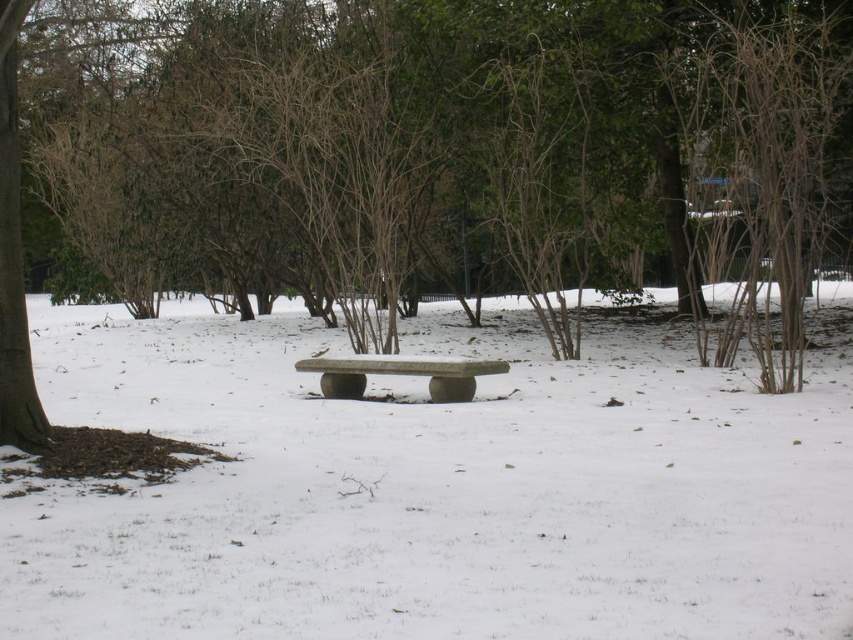
Is white matte bench at center closer to camera compared to green leafy tree at center?

Yes, white matte bench at center is closer to the viewer.

Locate an element on the screen. The height and width of the screenshot is (640, 853). white matte bench at center is located at coordinates (434, 490).

Is green leafy tree at center to the left of gray stone bench at center from the viewer's perspective?

No, green leafy tree at center is not to the left of gray stone bench at center.

Is green leafy tree at center taller than gray stone bench at center?

Yes, green leafy tree at center is taller than gray stone bench at center.

Where is `green leafy tree at center`? Image resolution: width=853 pixels, height=640 pixels. green leafy tree at center is located at coordinates (473, 157).

Is white matte bench at center taller than gray stone bench at center?

Yes, white matte bench at center is taller than gray stone bench at center.

Does white matte bench at center have a greater width compared to gray stone bench at center?

Correct, the width of white matte bench at center exceeds that of gray stone bench at center.

Between point (288, 417) and point (454, 394), which one is positioned behind?

The point (454, 394) is behind.

You are a GUI agent. You are given a task and a screenshot of the screen. Output one action in this format:
    pyautogui.click(x=<x>, y=<y>)
    Task: Click on the white matte bench at center
    This screenshot has height=640, width=853.
    Given the screenshot: What is the action you would take?
    pyautogui.click(x=434, y=490)